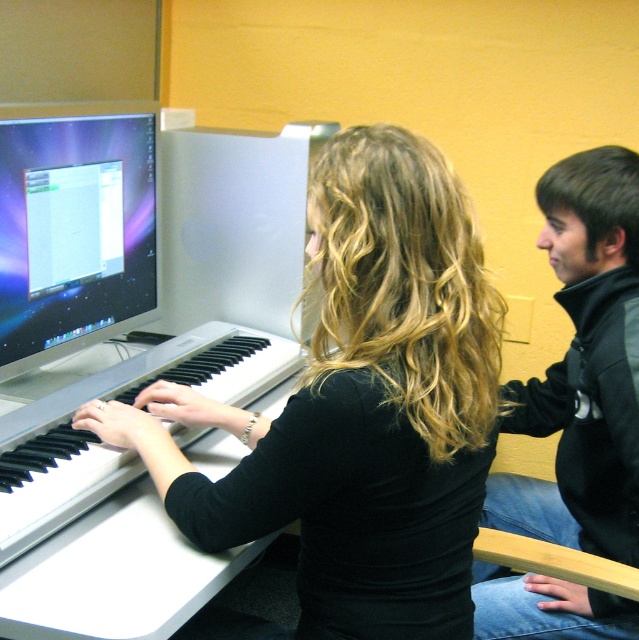
Question: Which object appears farthest from the camera in this image?

Choices:
 (A) black matte keyboard at center
 (B) black plastic piano at center
 (C) black fleece jacket at upper right

Answer: (C)

Question: Among these points, which one is nearest to the camera?

Choices:
 (A) (187, 340)
 (B) (406, 608)
 (C) (132, 280)

Answer: (B)

Question: Does black fleece jacket at upper right appear over black plastic piano at center?

Choices:
 (A) yes
 (B) no

Answer: (A)

Question: Is the position of black fleece jacket at upper right less distant than that of black plastic piano at center?

Choices:
 (A) yes
 (B) no

Answer: (B)

Question: Which object appears closest to the camera in this image?

Choices:
 (A) black plastic piano at center
 (B) shiny silver monitor at left
 (C) black fleece jacket at upper right
 (D) black matte keyboard at center

Answer: (D)

Question: Does shiny silver monitor at left appear on the left side of black plastic piano at center?

Choices:
 (A) no
 (B) yes

Answer: (B)